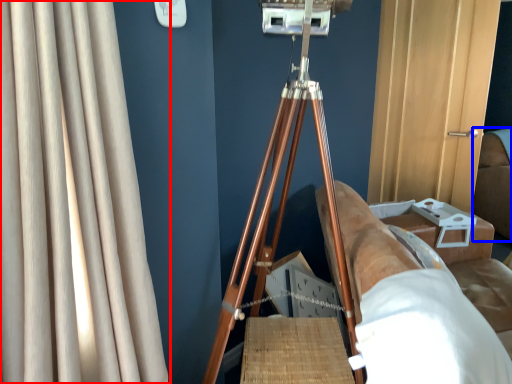
Question: Among these objects, which one is farthest to the camera, curtain (highlighted by a red box) or couch (highlighted by a blue box)?

Choices:
 (A) curtain
 (B) couch

Answer: (B)